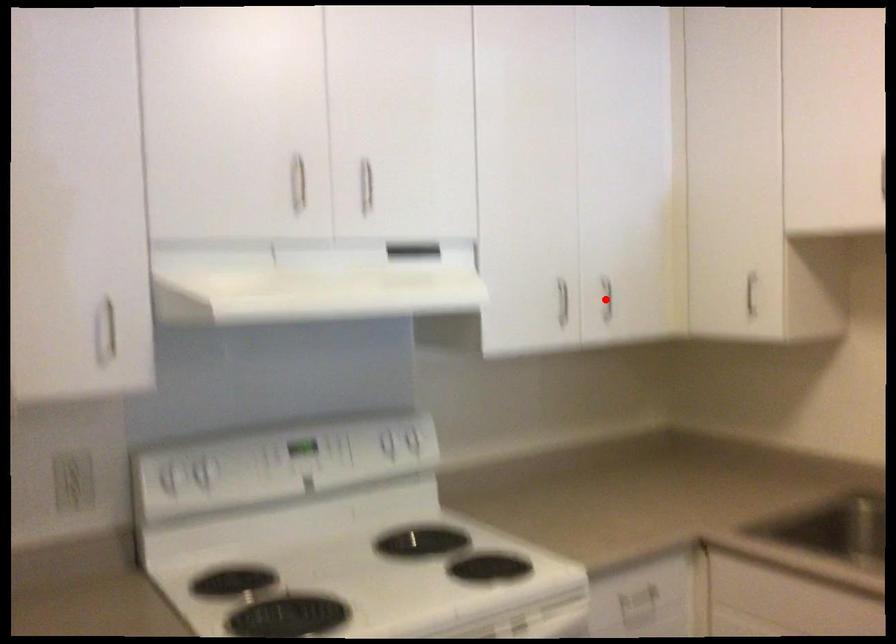
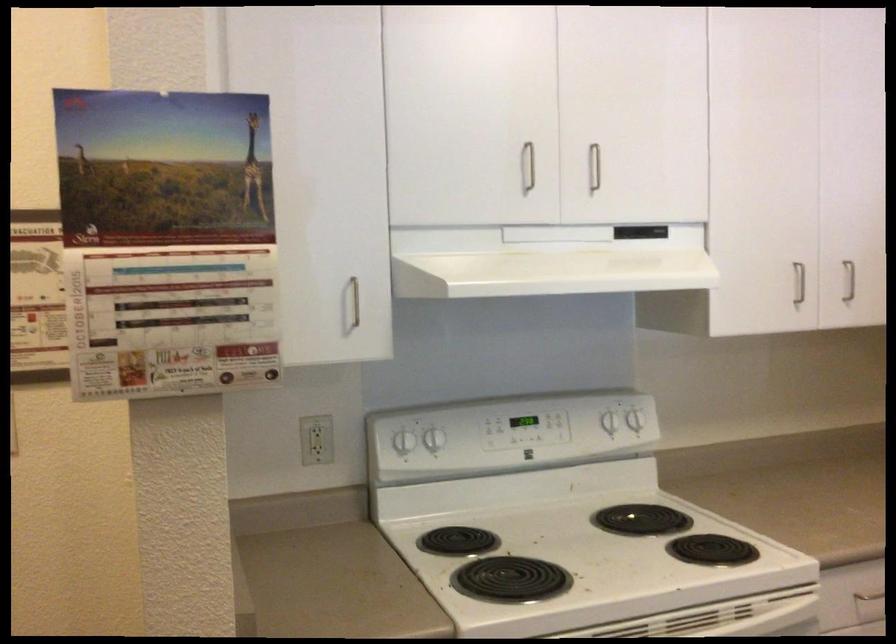
Find the pixel in the second image that matches the highlighted location in the first image.

(849, 281)